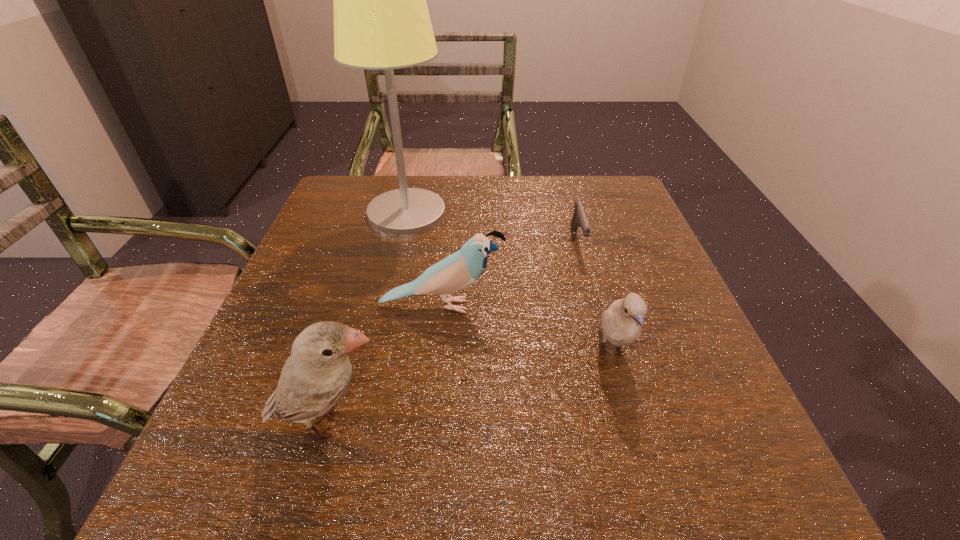
This screenshot has height=540, width=960. In order to click on vacant region at the near edge of the desktop in this screenshot , I will do `click(560, 501)`.

Identify the location of free space at the left edge of the desktop. (277, 440).

This screenshot has height=540, width=960. In the image, there is a desktop. Find the location of `free space at the right edge`. free space at the right edge is located at coordinates (651, 376).

Locate an element on the screen. The image size is (960, 540). free location at the far left corner is located at coordinates (382, 183).

The width and height of the screenshot is (960, 540). I want to click on free spot at the near left corner of the desktop, so click(251, 468).

The height and width of the screenshot is (540, 960). In the image, there is a desktop. In order to click on free space at the far right corner in this screenshot , I will do `click(620, 201)`.

Image resolution: width=960 pixels, height=540 pixels. I want to click on vacant space that's between the table lamp and the third nearest object, so click(424, 259).

At what (x,y) coordinates should I click in order to perform the action: click on free space that is in between the tallest bird and the pistol. Please return your answer as a coordinate pair (x, y). Looking at the image, I should click on (453, 333).

Find the location of a particular element. vacant space that is in between the nearest object and the shortest object is located at coordinates (453, 333).

Where is `blank region between the nearest object and the farthest bird`? blank region between the nearest object and the farthest bird is located at coordinates (385, 365).